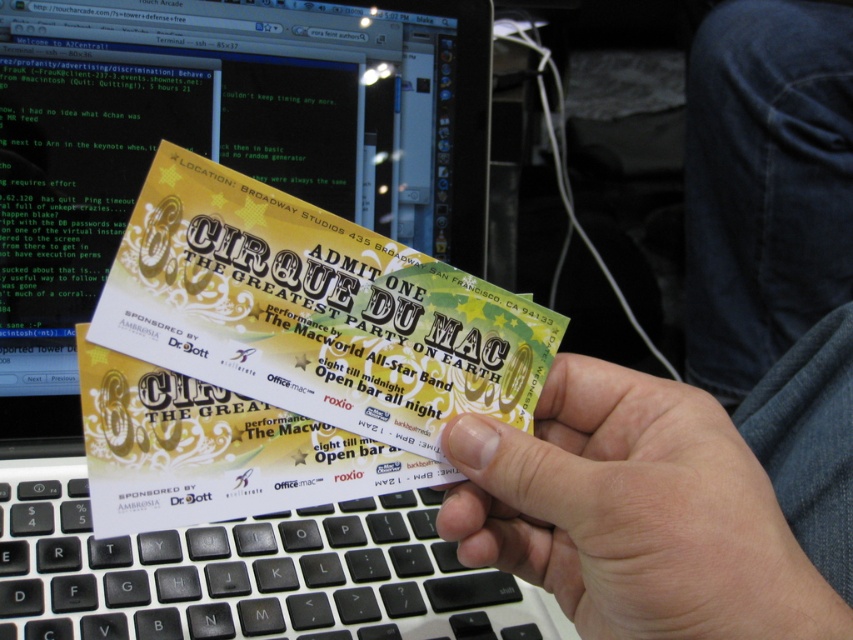
Question: Is yellow paper ticket at center below matte black laptop at center?

Choices:
 (A) no
 (B) yes

Answer: (B)

Question: Is matte black laptop at center above denim pants at lower right?

Choices:
 (A) yes
 (B) no

Answer: (B)

Question: Does yellow paper ticket at center appear over denim pants at lower right?

Choices:
 (A) yes
 (B) no

Answer: (B)

Question: Which point is closer to the camera?

Choices:
 (A) matte black laptop at center
 (B) smooth skin hand at center
 (C) denim pants at lower right

Answer: (B)

Question: Among these objects, which one is nearest to the camera?

Choices:
 (A) denim pants at lower right
 (B) yellow paper ticket at center
 (C) matte black laptop at center

Answer: (B)

Question: Among these points, which one is nearest to the camera?

Choices:
 (A) (310, 369)
 (B) (576, 472)
 (C) (200, 592)
 (D) (813, 292)

Answer: (B)